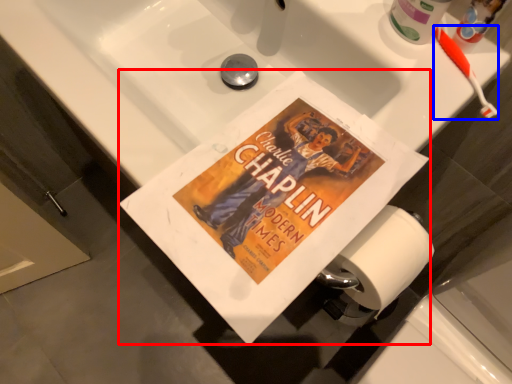
Question: Among these objects, which one is farthest to the camera, paperback book (highlighted by a red box) or toothbrush (highlighted by a blue box)?

Choices:
 (A) paperback book
 (B) toothbrush

Answer: (B)